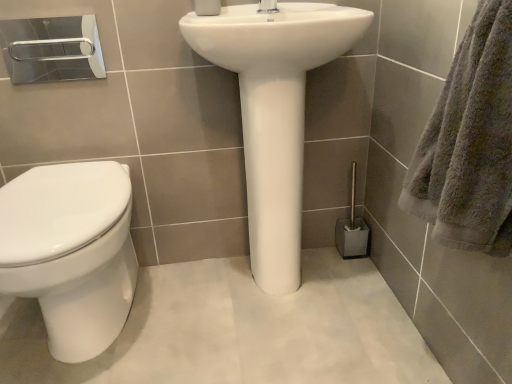
Where is `vacant space in front of metallic silver toilet brush at lower right`? vacant space in front of metallic silver toilet brush at lower right is located at coordinates (352, 281).